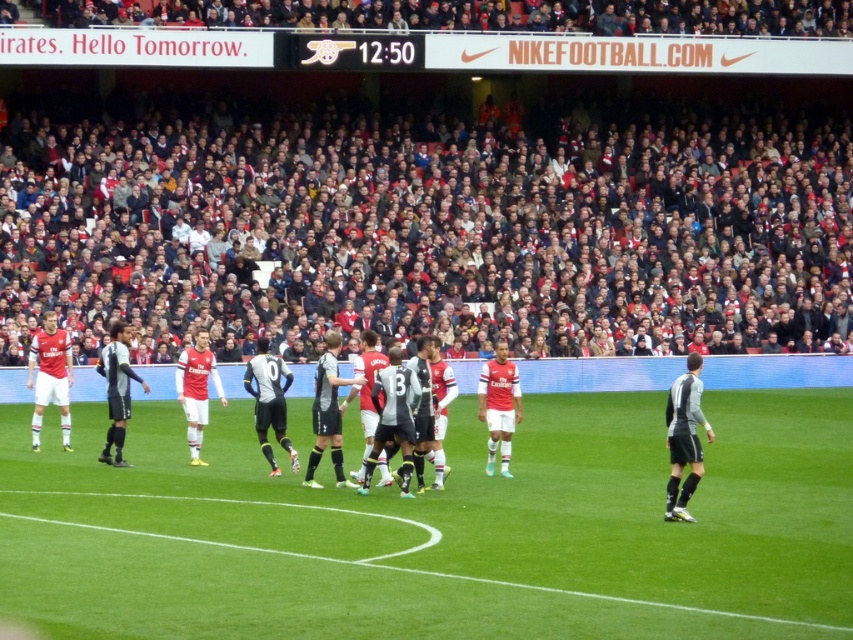
You are a drone operator trying to capture a live football match at Emirates Stadium. Your drone is currently hovering at point 0.8, 0.5. The green grass football field at center is your target. Can you adjust your drone to focus on the field without moving more than 0.05 units in any direction?

The green grass football field at center is located at point (x=444, y=531). Your current position is (x=426, y=512). The required adjustment is 0.031 in the x direction and 0.021 in the y direction. Since both adjustments are within the 0.05 unit limit, yes, you can adjust your drone to focus on the field without exceeding the movement limit.

You are a photographer at the Emirates Stadium trying to capture a clear shot of the black jersey at right without the dark gray fabric crowd at upper center blocking it. Based on their sizes, is this possible?

The dark gray fabric crowd at upper center is taller than the black jersey at right, so it would block the view of the black jersey at right. Adjust your angle or position to avoid the crowd.

You are a drone operator trying to capture a birdseye view of the game. You have to fly your drone over the green grass football field at center and the white jersey players at center. Which one should you fly over first to get a clear shot of both?

The green grass football field at center is below the white jersey players at center, so you should fly over the white jersey players at center first to ensure the drone can capture both objects in the shot without obstruction.